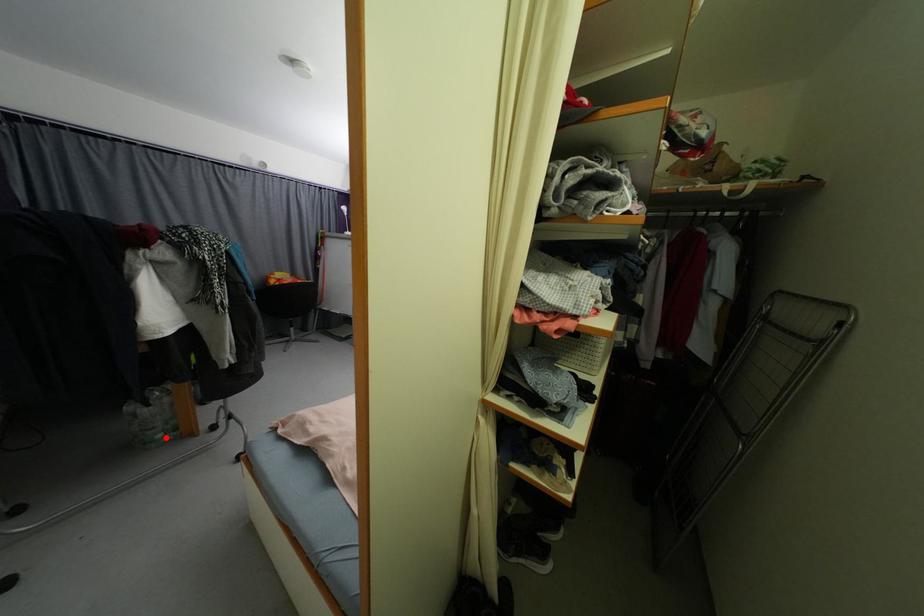
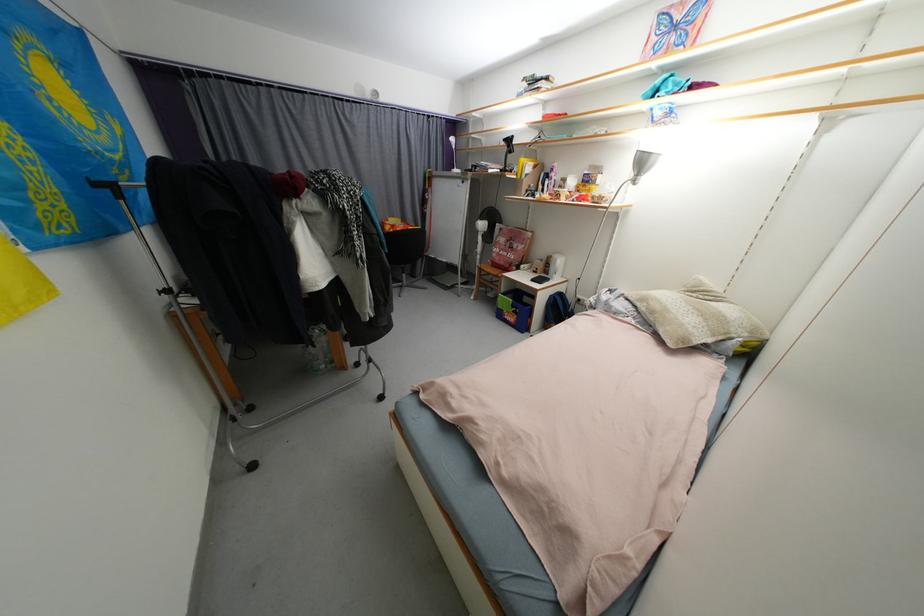
Question: A red point is marked in image1. In image2, is the corresponding 3D point closer to the camera or farther? Reply with the corresponding letter.

Choices:
 (A) The corresponding 3D point is closer.
 (B) The corresponding 3D point is farther.

Answer: (B)